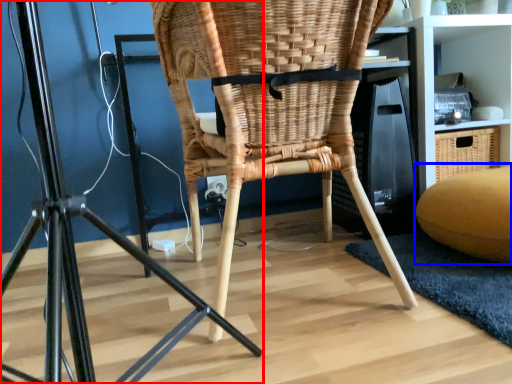
Question: Which point is closer to the camera, furniture (highlighted by a red box) or bean bag chair (highlighted by a blue box)?

Choices:
 (A) furniture
 (B) bean bag chair

Answer: (A)